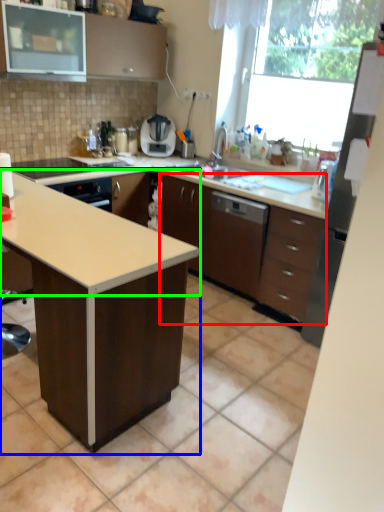
Question: Estimate the real-world distances between objects in this image. Which object is closer to cabinetry (highlighted by a red box), table (highlighted by a blue box) or countertop (highlighted by a green box)?

Choices:
 (A) table
 (B) countertop

Answer: (B)